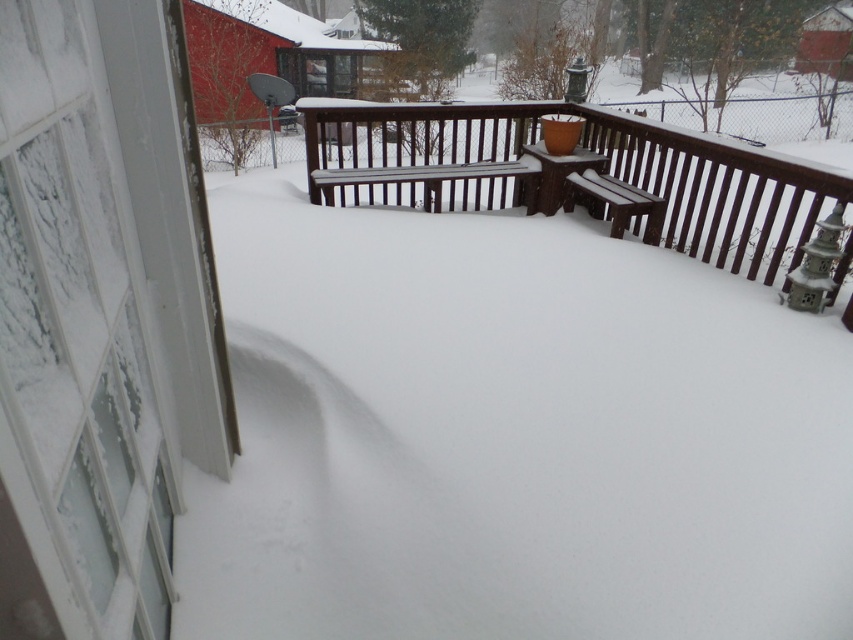
Question: Among these objects, which one is nearest to the camera?

Choices:
 (A) brown wooden bench at right
 (B) brown wood bench at center

Answer: (B)

Question: Is brown wood bench at center wider than brown wooden bench at right?

Choices:
 (A) yes
 (B) no

Answer: (A)

Question: Is brown wood bench at center positioned behind brown wooden bench at right?

Choices:
 (A) yes
 (B) no

Answer: (B)

Question: Which of the following is the farthest from the observer?

Choices:
 (A) (610, 193)
 (B) (590, 209)

Answer: (B)

Question: Is brown wood bench at center bigger than brown wooden bench at right?

Choices:
 (A) yes
 (B) no

Answer: (A)